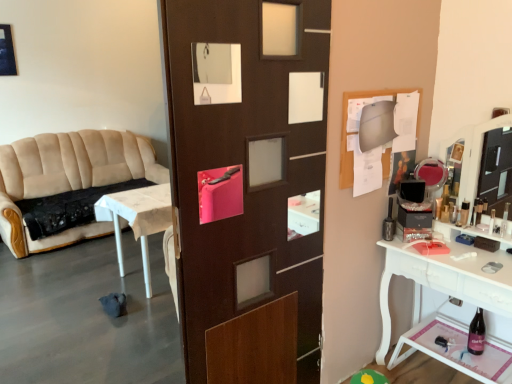
Question: Considering the relative positions of beige fabric couch at left and clear plastic bottle at right, placed as the first toiletry when sorted from front to back, in the image provided, is beige fabric couch at left behind clear plastic bottle at right, placed as the first toiletry when sorted from front to back,?

Choices:
 (A) yes
 (B) no

Answer: (A)

Question: Is clear plastic bottle at right, which is the second toiletry in left-to-right order, at the back of beige fabric couch at left?

Choices:
 (A) yes
 (B) no

Answer: (B)

Question: Is clear plastic bottle at right, positioned as the second toiletry in back-to-front order, surrounded by beige fabric couch at left?

Choices:
 (A) yes
 (B) no

Answer: (B)

Question: Can you confirm if beige fabric couch at left is smaller than clear plastic bottle at right, placed as the first toiletry when sorted from front to back?

Choices:
 (A) no
 (B) yes

Answer: (A)

Question: From the image's perspective, does beige fabric couch at left appear lower than clear plastic bottle at right, which ranks as the first toiletry in right-to-left order?

Choices:
 (A) no
 (B) yes

Answer: (A)

Question: From the image's perspective, relative to beige fabric couch at left, is metallic silver toiletry at right, arranged as the first toiletry when viewed from the back, above or below?

Choices:
 (A) below
 (B) above

Answer: (A)

Question: Considering the positions of metallic silver toiletry at right, the second toiletry when ordered from front to back, and beige fabric couch at left in the image, is metallic silver toiletry at right, the second toiletry when ordered from front to back, wider or thinner than beige fabric couch at left?

Choices:
 (A) thin
 (B) wide

Answer: (A)

Question: In terms of height, does metallic silver toiletry at right, which is the 1th toiletry from left to right, look taller or shorter compared to beige fabric couch at left?

Choices:
 (A) tall
 (B) short

Answer: (B)

Question: Looking at the image, does metallic silver toiletry at right, the second toiletry when ordered from front to back, seem bigger or smaller compared to beige fabric couch at left?

Choices:
 (A) big
 (B) small

Answer: (B)

Question: Relative to beige fabric couch at left, is clear plastic bottle at right, which ranks as the first toiletry in right-to-left order, in front or behind?

Choices:
 (A) front
 (B) behind

Answer: (A)

Question: From a real-world perspective, is clear plastic bottle at right, which ranks as the first toiletry in right-to-left order, above or below beige fabric couch at left?

Choices:
 (A) below
 (B) above

Answer: (B)

Question: From the image's perspective, relative to beige fabric couch at left, is clear plastic bottle at right, which ranks as the first toiletry in right-to-left order, above or below?

Choices:
 (A) below
 (B) above

Answer: (A)

Question: Considering the relative positions of clear plastic bottle at right, positioned as the second toiletry in back-to-front order, and beige fabric couch at left in the image provided, is clear plastic bottle at right, positioned as the second toiletry in back-to-front order, to the left or to the right of beige fabric couch at left?

Choices:
 (A) right
 (B) left

Answer: (A)

Question: In the image, is beige fabric couch at left on the left side or the right side of metallic silver toiletry at right, which is the second toiletry in right-to-left order?

Choices:
 (A) right
 (B) left

Answer: (B)

Question: Which is correct: beige fabric couch at left is inside metallic silver toiletry at right, which is the 1th toiletry from left to right, or outside of it?

Choices:
 (A) outside
 (B) inside

Answer: (A)